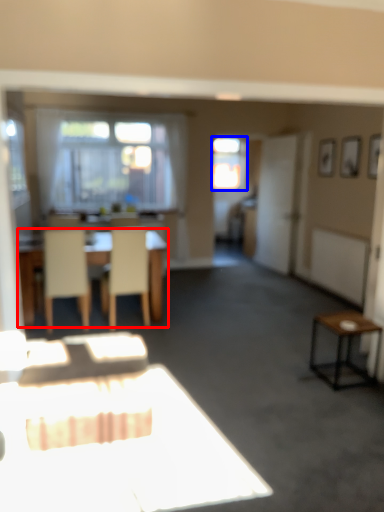
Question: Among these objects, which one is farthest to the camera, table (highlighted by a red box) or window (highlighted by a blue box)?

Choices:
 (A) table
 (B) window

Answer: (B)